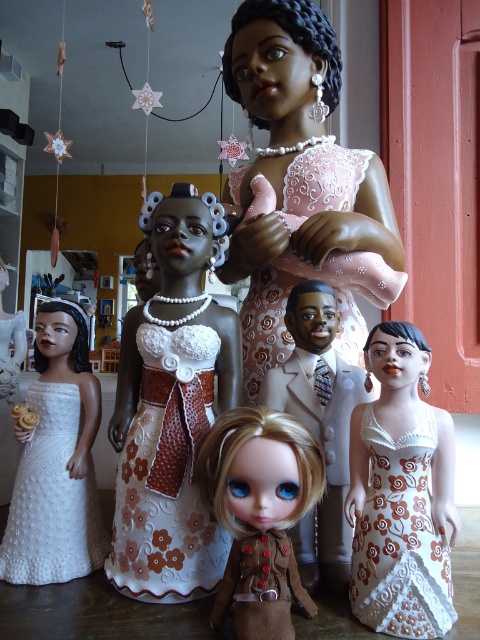
You are organizing a doll display and need to place the pink lace dress at center and the white fabric dress at center side by side. Which dress requires more horizontal space for proper placement?

The pink lace dress at center requires more horizontal space because its width surpasses that of the white fabric dress at center.

You are a collector who wants to place a new doll wearing a pink lace dress at center into your display case that has a depth of 36 inches. Will the doll fit comfortably within the case without touching the back wall?

The pink lace dress at center is 37.56 inches away from the viewer. Since the display case has a depth of 36 inches, the doll will not fit comfortably as it would be 1.56 inches too close to the back wall.